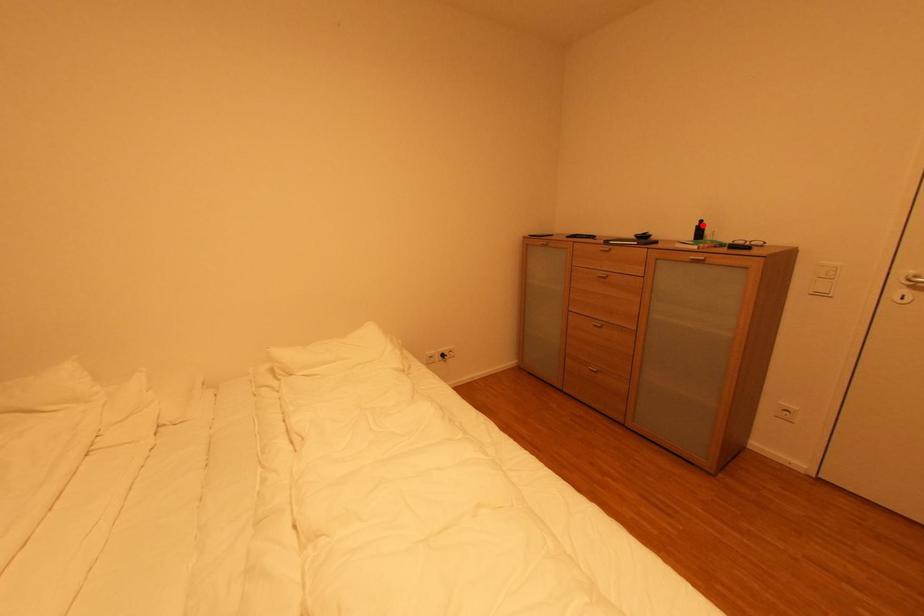
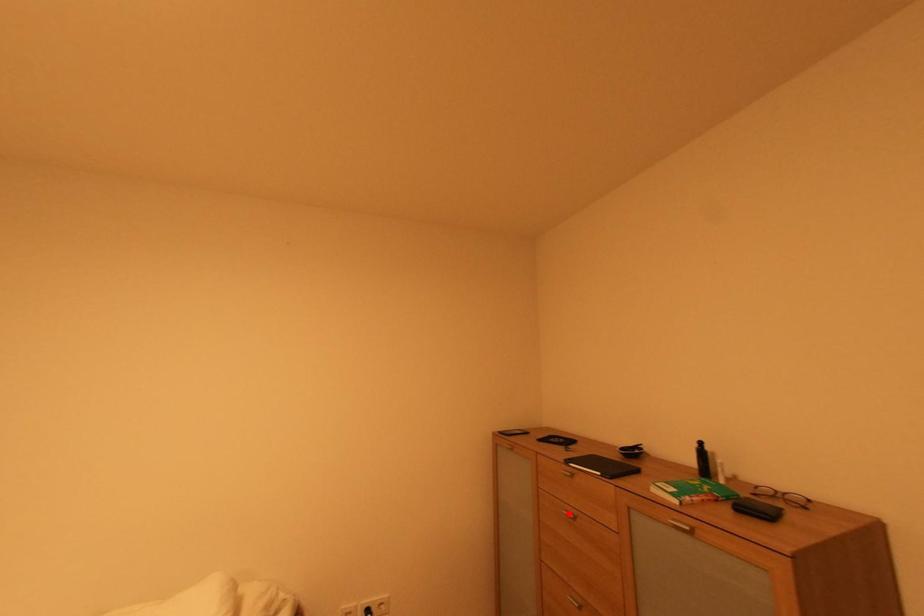
I am providing you with two images of the same scene from different viewpoints. A red point is marked on the first image and another point is marked on the second image. Is the red point in image1 aligned with the point shown in image2?

No